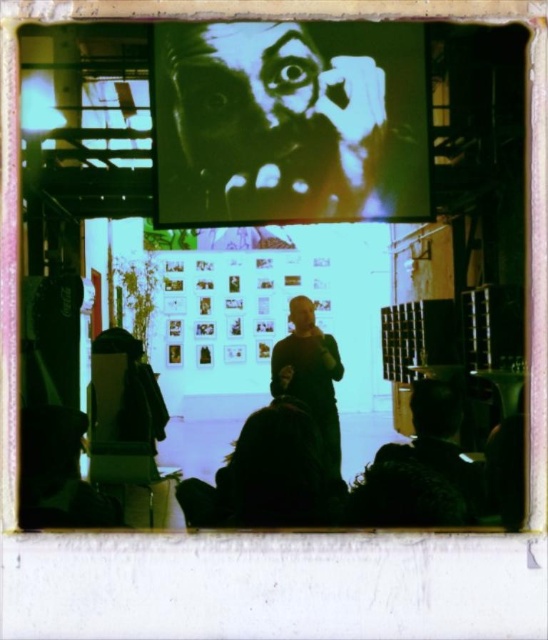
Question: Which object appears closest to the camera in this image?

Choices:
 (A) dark brown leather jacket at center
 (B) high contrast face at center

Answer: (A)

Question: In this image, where is high contrast face at center located relative to dark brown leather jacket at center?

Choices:
 (A) below
 (B) above

Answer: (B)

Question: From the image, what is the correct spatial relationship of high contrast face at center in relation to dark brown leather jacket at center?

Choices:
 (A) right
 (B) left

Answer: (B)

Question: Is high contrast face at center closer to the viewer compared to dark brown leather jacket at center?

Choices:
 (A) yes
 (B) no

Answer: (B)